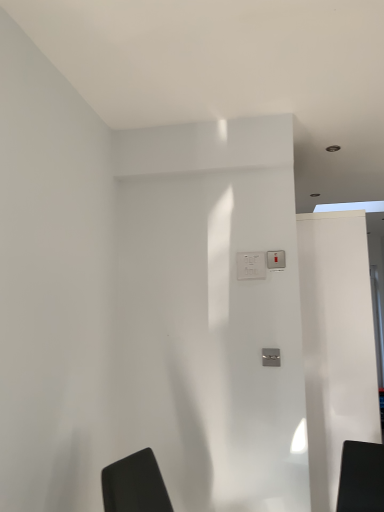
Question: From the image's perspective, is metallic silver light switch at center above white plastic electric outlet at center?

Choices:
 (A) yes
 (B) no

Answer: (A)

Question: Does metallic silver light switch at center have a larger size compared to white plastic electric outlet at center?

Choices:
 (A) no
 (B) yes

Answer: (A)

Question: Does metallic silver light switch at center turn towards white plastic electric outlet at center?

Choices:
 (A) no
 (B) yes

Answer: (A)

Question: Is metallic silver light switch at center oriented away from white plastic electric outlet at center?

Choices:
 (A) no
 (B) yes

Answer: (A)

Question: Can you confirm if metallic silver light switch at center is positioned to the left of white plastic electric outlet at center?

Choices:
 (A) yes
 (B) no

Answer: (B)

Question: From the image's perspective, is metallic silver light switch at center above or below white plastic electric outlet at center?

Choices:
 (A) above
 (B) below

Answer: (A)

Question: Do you think metallic silver light switch at center is within white plastic electric outlet at center, or outside of it?

Choices:
 (A) inside
 (B) outside

Answer: (B)

Question: Is point (284, 254) closer or farther from the camera than point (251, 273)?

Choices:
 (A) farther
 (B) closer

Answer: (B)

Question: From a real-world perspective, relative to white plastic electric outlet at center, is metallic silver light switch at center vertically above or below?

Choices:
 (A) above
 (B) below

Answer: (A)

Question: In terms of height, does metallic silver light switch at center look taller or shorter compared to white glossy screen door at right?

Choices:
 (A) tall
 (B) short

Answer: (B)

Question: Is point (266, 250) positioned closer to the camera than point (337, 408)?

Choices:
 (A) farther
 (B) closer

Answer: (B)

Question: In terms of size, does metallic silver light switch at center appear bigger or smaller than white glossy screen door at right?

Choices:
 (A) small
 (B) big

Answer: (A)

Question: Considering the relative positions of metallic silver light switch at center and white glossy screen door at right in the image provided, is metallic silver light switch at center to the left or to the right of white glossy screen door at right?

Choices:
 (A) left
 (B) right

Answer: (A)

Question: Do you think white plastic electric outlet at center is within white glossy screen door at right, or outside of it?

Choices:
 (A) outside
 (B) inside

Answer: (A)

Question: Is white plastic electric outlet at center taller or shorter than white glossy screen door at right?

Choices:
 (A) tall
 (B) short

Answer: (B)